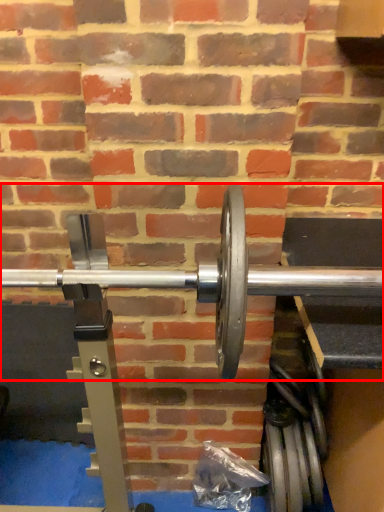
Question: Where is dumbbell (annotated by the red box) located in relation to tire in the image?

Choices:
 (A) left
 (B) right

Answer: (A)